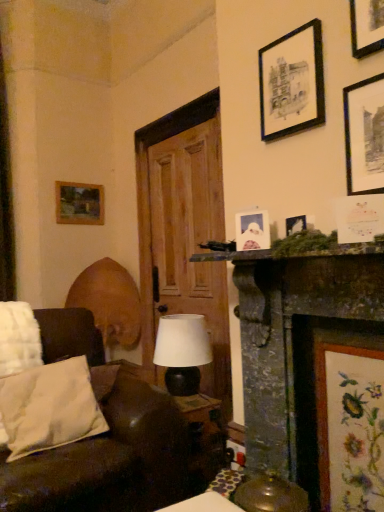
Question: From the image's perspective, is black matte picture frame at upper right, the 3th picture frame in the top-to-bottom sequence, beneath matte black lamp at center?

Choices:
 (A) yes
 (B) no

Answer: (B)

Question: Is black matte picture frame at upper right, placed as the 4th picture frame when sorted from bottom to top, thinner than matte black lamp at center?

Choices:
 (A) yes
 (B) no

Answer: (A)

Question: Does black matte picture frame at upper right, positioned as the 1th picture frame in right-to-left order, contain matte black lamp at center?

Choices:
 (A) yes
 (B) no

Answer: (B)

Question: Is black matte picture frame at upper right, the fourth picture frame when ordered from back to front, at the right side of matte black lamp at center?

Choices:
 (A) yes
 (B) no

Answer: (A)

Question: Is there a large distance between black matte picture frame at upper right, the 3th picture frame in the top-to-bottom sequence, and matte black lamp at center?

Choices:
 (A) yes
 (B) no

Answer: (A)

Question: Could you tell me if black matte picture frame at upper right, positioned as the 1th picture frame in right-to-left order, is facing matte black lamp at center?

Choices:
 (A) yes
 (B) no

Answer: (B)

Question: Can you confirm if white paper picture frame at upper center, the fifth picture frame when ordered from top to bottom, is smaller than black matte picture frame at upper right, marked as the first picture frame in a top-to-bottom arrangement?

Choices:
 (A) yes
 (B) no

Answer: (A)

Question: Is white paper picture frame at upper center, arranged as the second picture frame when viewed from the left, in contact with black matte picture frame at upper right, which ranks as the sixth picture frame in bottom-to-top order?

Choices:
 (A) yes
 (B) no

Answer: (B)

Question: From a real-world perspective, is white paper picture frame at upper center, which is counted as the fifth picture frame, starting from the right, below black matte picture frame at upper right, arranged as the 3th picture frame when viewed from the left?

Choices:
 (A) no
 (B) yes

Answer: (B)

Question: Does white paper picture frame at upper center, acting as the 3th picture frame starting from the back, have a larger size compared to black matte picture frame at upper right, marked as the first picture frame in a top-to-bottom arrangement?

Choices:
 (A) no
 (B) yes

Answer: (A)

Question: Would you say white paper picture frame at upper center, arranged as the second picture frame when viewed from the left, contains black matte picture frame at upper right, marked as the second picture frame in a back-to-front arrangement?

Choices:
 (A) no
 (B) yes

Answer: (A)

Question: Is the depth of white paper picture frame at upper center, the fifth picture frame when ordered from top to bottom, less than that of black matte picture frame at upper right, marked as the first picture frame in a top-to-bottom arrangement?

Choices:
 (A) no
 (B) yes

Answer: (B)

Question: Is wooden picture frame at upper left, which is the second picture frame in top-to-bottom order, a part of dark gray stone fireplace at center right?

Choices:
 (A) yes
 (B) no

Answer: (B)